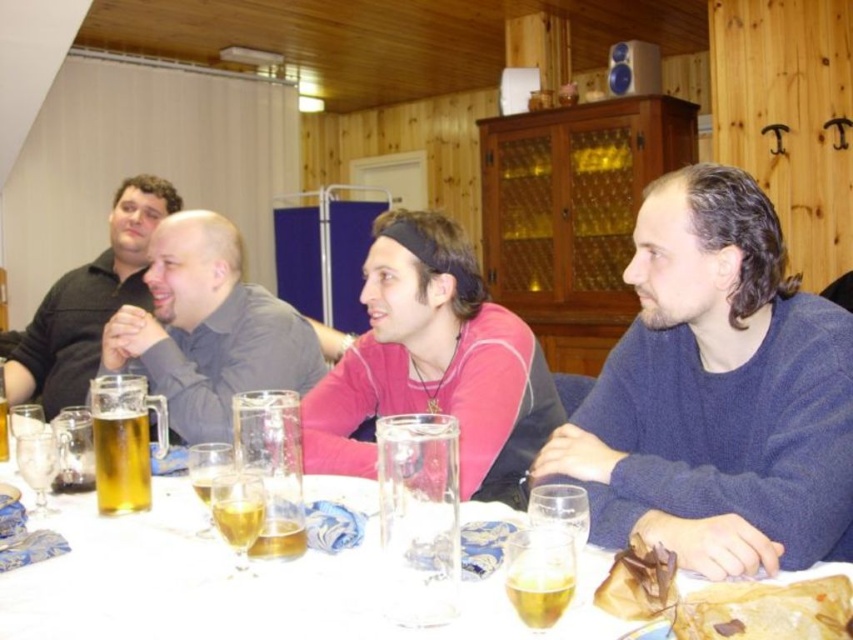
Is pink jersey at center to the left of gray matte shirt at center from the viewer's perspective?

In fact, pink jersey at center is to the right of gray matte shirt at center.

Who is higher up, pink jersey at center or gray matte shirt at center?

Positioned higher is gray matte shirt at center.

Locate an element on the screen. pink jersey at center is located at coordinates coord(433,364).

Which is behind, point (685, 400) or point (302, 552)?

Positioned behind is point (685, 400).

What do you see at coordinates (717, 394) in the screenshot? I see `dark blue sweater at center` at bounding box center [717, 394].

Is point (659, 385) positioned behind point (289, 531)?

Yes, point (659, 385) is behind point (289, 531).

At what (x,y) coordinates should I click in order to perform the action: click on dark blue sweater at center. Please return your answer as a coordinate pair (x, y). Looking at the image, I should click on (717, 394).

Can you confirm if matte black shirt at left is taller than brown crinkled paper at lower right?

Yes.

What do you see at coordinates (88, 301) in the screenshot? I see `matte black shirt at left` at bounding box center [88, 301].

Image resolution: width=853 pixels, height=640 pixels. Find the location of `matte black shirt at left`. matte black shirt at left is located at coordinates (88, 301).